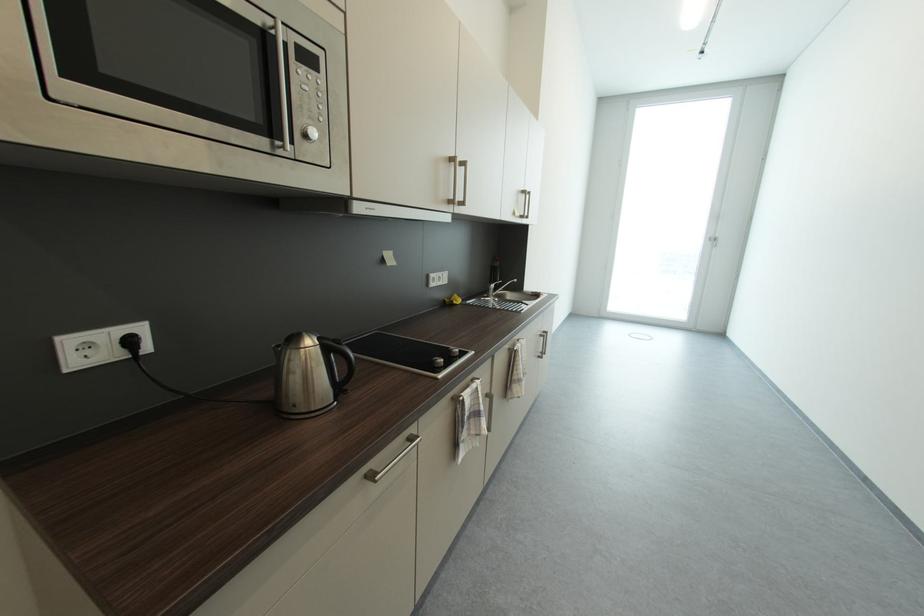
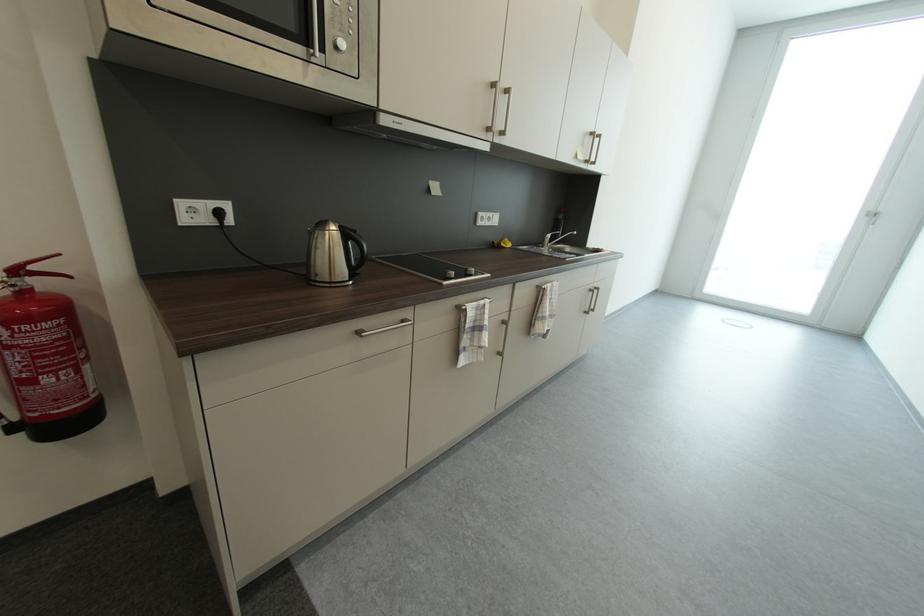
The point at (548, 338) is marked in the first image. Where is the corresponding point in the second image?

(598, 292)